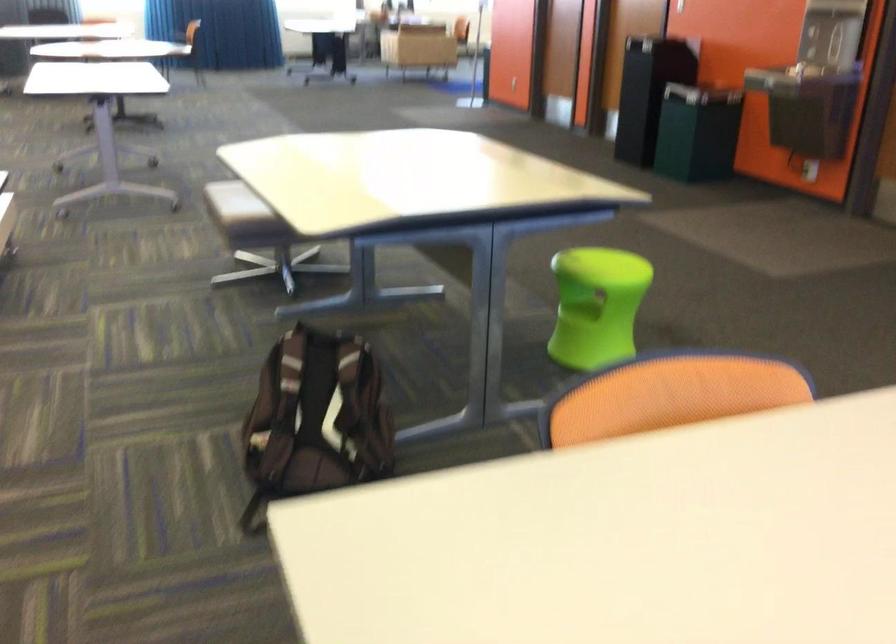
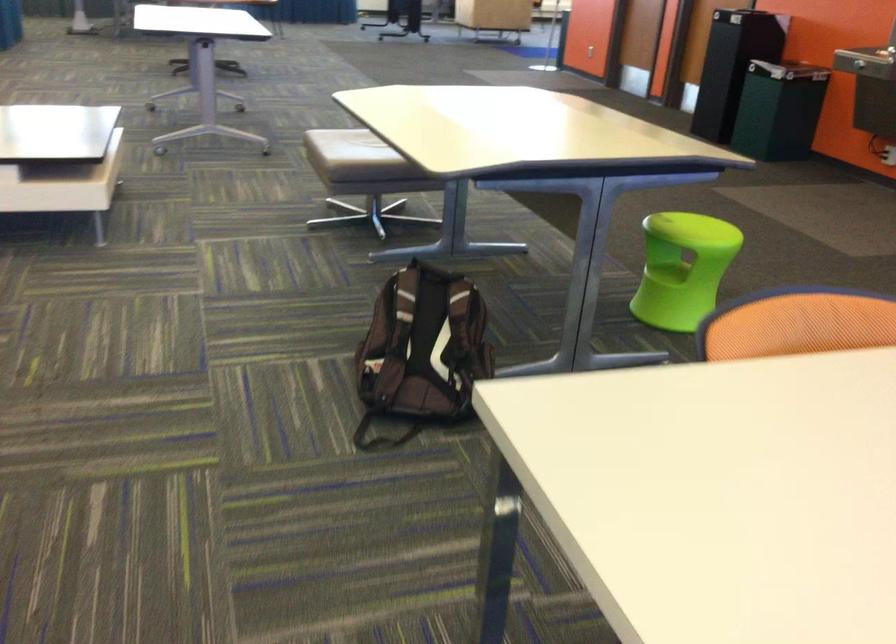
In a continuous first-person perspective shot, in which direction is the camera moving?

The cameraman walked toward left, backward.